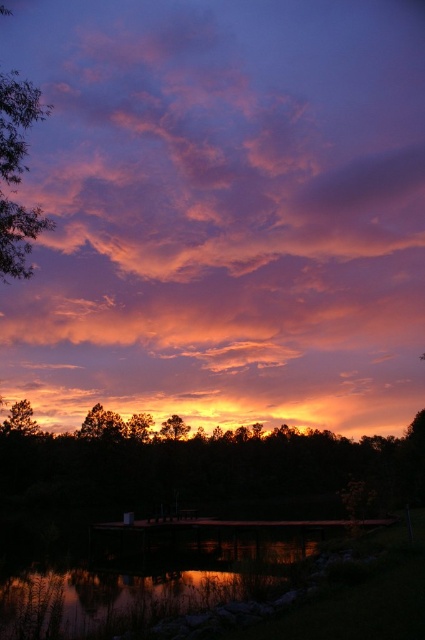
Does pink fluffy cloud at upper center have a lesser width compared to silhouetted bark tree at lower center?

No, pink fluffy cloud at upper center is not thinner than silhouetted bark tree at lower center.

This screenshot has height=640, width=425. What do you see at coordinates (223, 212) in the screenshot?
I see `pink fluffy cloud at upper center` at bounding box center [223, 212].

I want to click on pink fluffy cloud at upper center, so click(223, 212).

Based on the photo, is the position of dark green leafy tree at center less distant than that of reflective glass water at lower center?

No, it is not.

Between point (380, 442) and point (56, 604), which one is positioned behind?

Positioned behind is point (380, 442).

This screenshot has width=425, height=640. Identify the location of dark green leafy tree at center. (204, 467).

Does reflective glass water at lower center have a lesser width compared to silhouetted bark tree at lower center?

Incorrect, reflective glass water at lower center's width is not less than silhouetted bark tree at lower center's.

I want to click on reflective glass water at lower center, so click(149, 586).

Is point (95, 586) farther from viewer compared to point (178, 429)?

That is False.

Locate an element on the screen. This screenshot has height=640, width=425. reflective glass water at lower center is located at coordinates (149, 586).